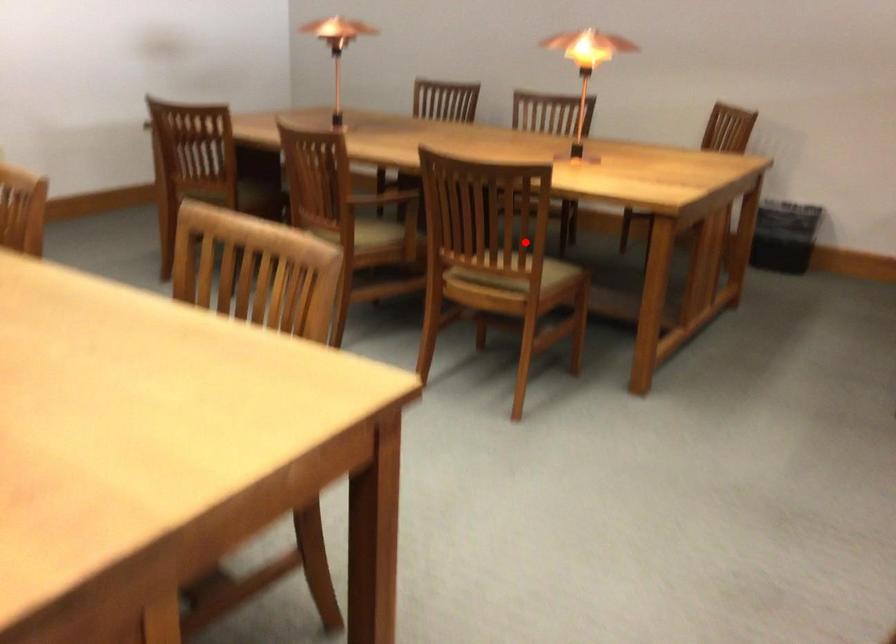
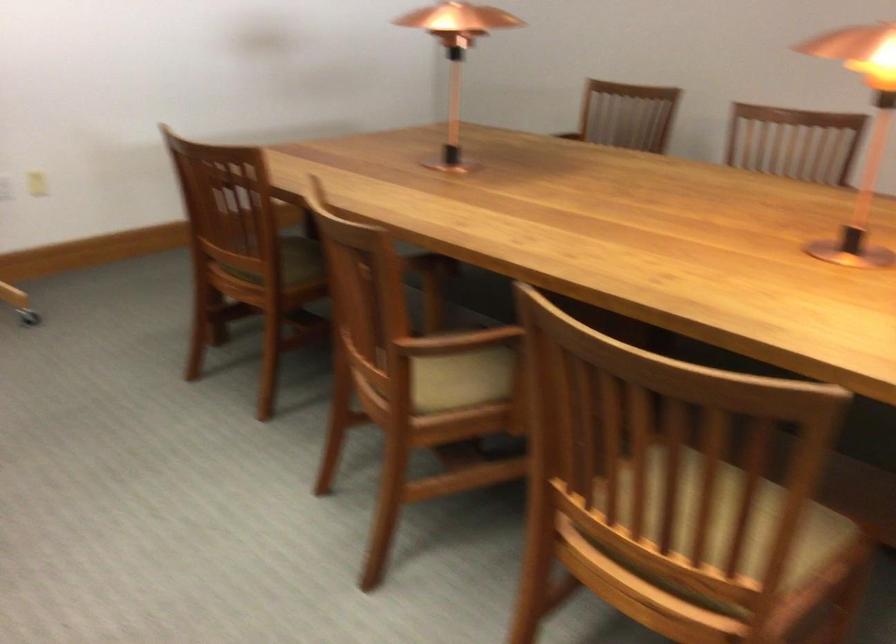
Where in the second image is the point corresponding to the highlighted location from the first image?

(728, 526)